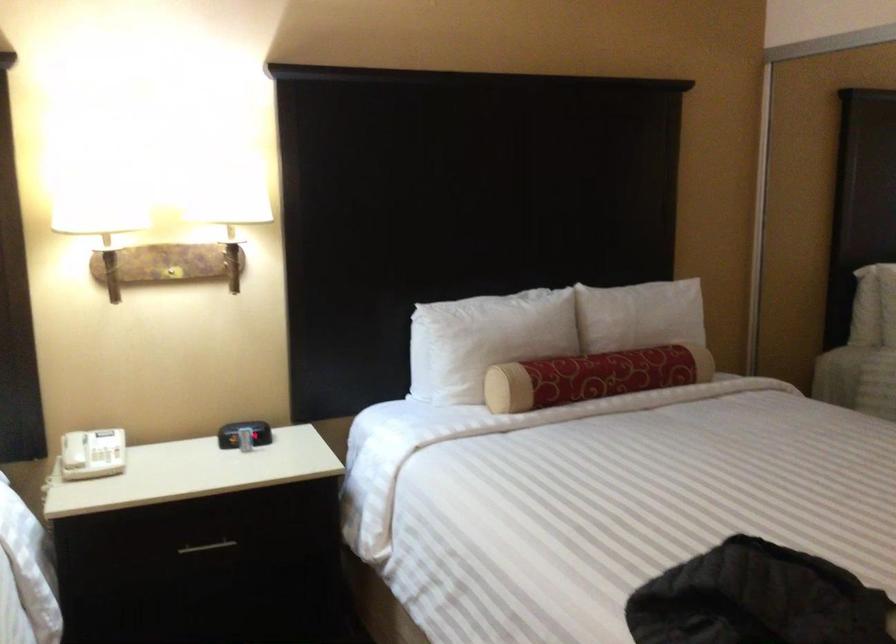
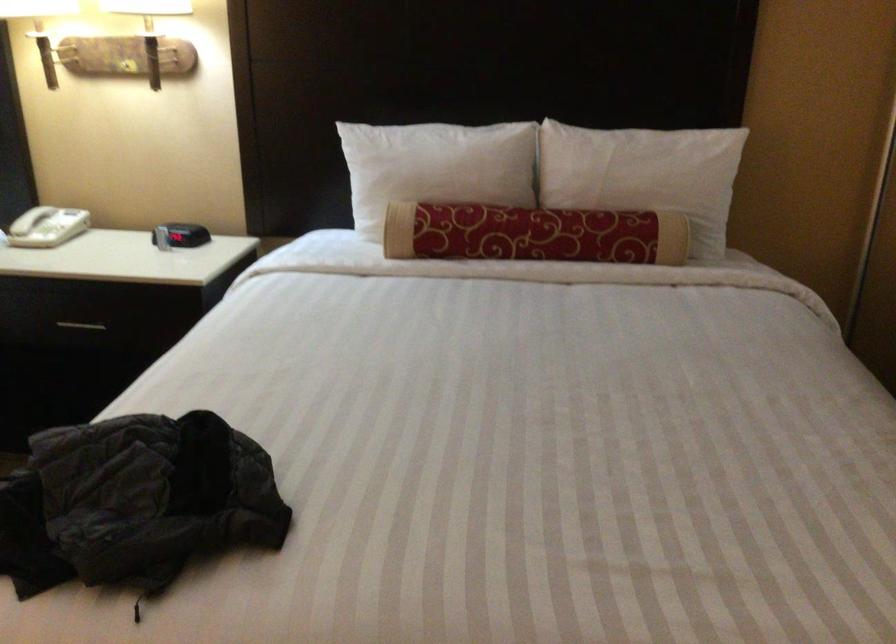
Where in the second image is the point corresponding to [666,314] from the first image?

(643, 174)